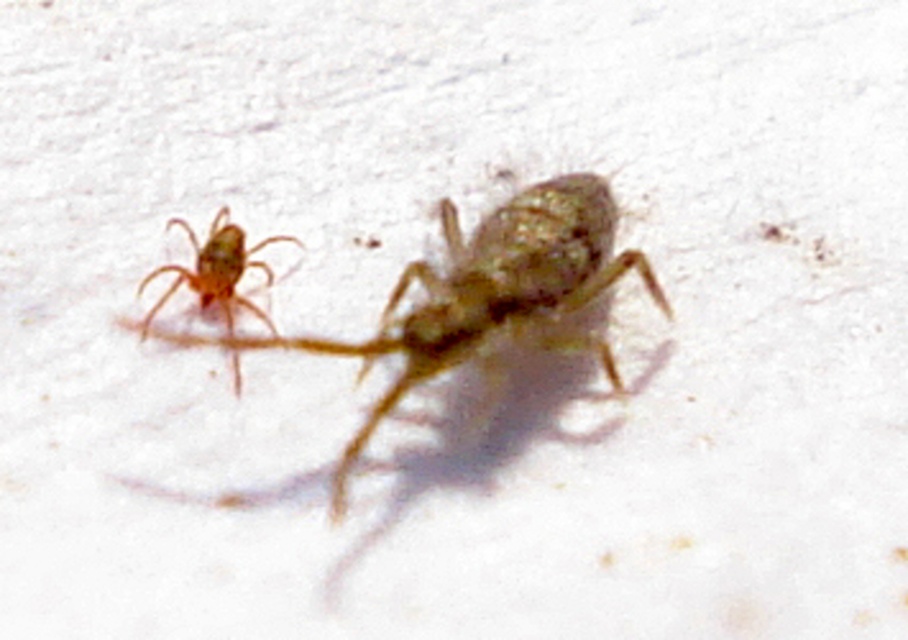
Question: Can you confirm if translucent brown bug at center is positioned to the right of translucent amber spider at left?

Choices:
 (A) no
 (B) yes

Answer: (B)

Question: Where is translucent brown bug at center located in relation to translucent amber spider at left in the image?

Choices:
 (A) right
 (B) left

Answer: (A)

Question: Does translucent brown bug at center have a larger size compared to translucent amber spider at left?

Choices:
 (A) no
 (B) yes

Answer: (B)

Question: Which point is farther to the camera?

Choices:
 (A) (525, 282)
 (B) (171, 224)

Answer: (B)